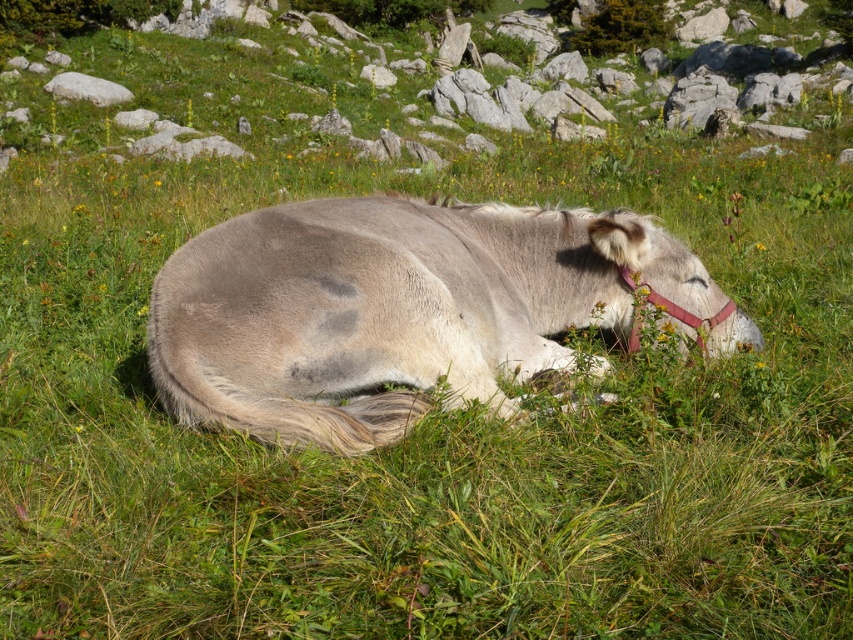
You are a photographer planning to capture the gray soft fur donkey at center and the white smooth rock at upper left in a single frame. Given that the camera can only focus on objects within a 2 meter width, can both objects fit in the frame if the donkey is wider than the rock?

The gray soft fur donkey at center is wider than the white smooth rock at upper left. Since the camera requires both objects to be within a 2 meter width, the total width of both objects combined may exceed the limit. Therefore, it is uncertain if both can fit without further information on their exact widths.

You are standing in the middle of the grassy hillside where the light gray horse is resting. You notice two points marked in the scene. Which point, point (386, 129) or point (73, 77), is closer to you?

Point (386, 129) is closer to the viewer than point (73, 77).

You are a photographer planning to take a photo of the light gray horse lying down on a grassy hillside. You want to ensure that the area around the horse is clear of any rocks or obstructions. Based on the scene description and the coordinates provided, is the location at point (409, 81) free of rocks?

The location at point (409, 81) is part of the green grassy hillside at upper center, which is described as having lush green grass with small yellow wildflowers. Since the area is characterized by grass and flowers, there are no rocks present at that specific point.